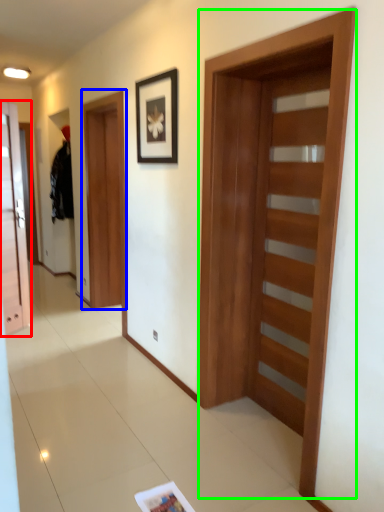
Question: Which object is positioned closest to door (highlighted by a red box)? Select from barn door (highlighted by a blue box) and barn door (highlighted by a green box).

Choices:
 (A) barn door
 (B) barn door

Answer: (A)